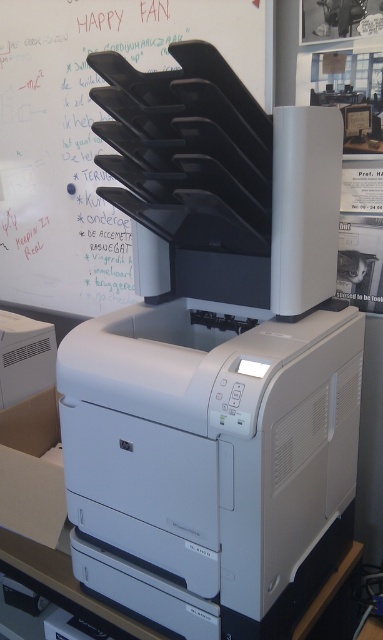
Consider the image. Is black plastic bulletin board at upper center bigger than cardboard box at lower left?

Indeed, black plastic bulletin board at upper center has a larger size compared to cardboard box at lower left.

Consider the image. Does black plastic bulletin board at upper center come behind cardboard box at lower left?

Yes, black plastic bulletin board at upper center is further from the viewer.

Between point (78, 10) and point (36, 397), which one is positioned behind?

Point (78, 10)

The width and height of the screenshot is (383, 640). What are the coordinates of `black plastic bulletin board at upper center` in the screenshot? It's located at (88, 132).